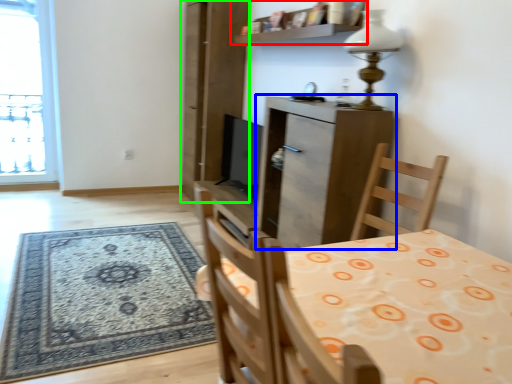
Question: Which object is the closest to the shelf (highlighted by a red box)? Choose among these: cabinetry (highlighted by a blue box) or screen door (highlighted by a green box).

Choices:
 (A) cabinetry
 (B) screen door

Answer: (B)